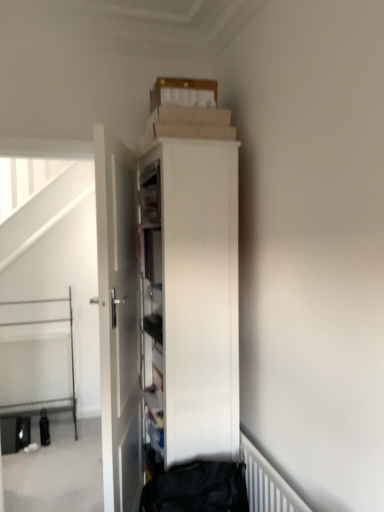
This screenshot has height=512, width=384. Find the location of `vacant region above white textured radiator at lower left, acting as the 2th radiator starting from the front (from a real-world perspective)`. vacant region above white textured radiator at lower left, acting as the 2th radiator starting from the front (from a real-world perspective) is located at coordinates (36, 335).